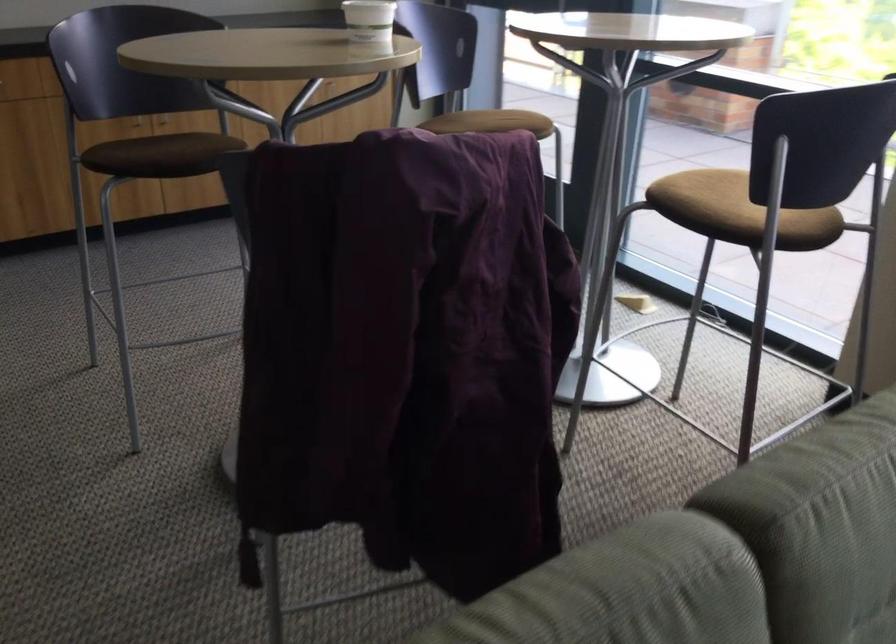
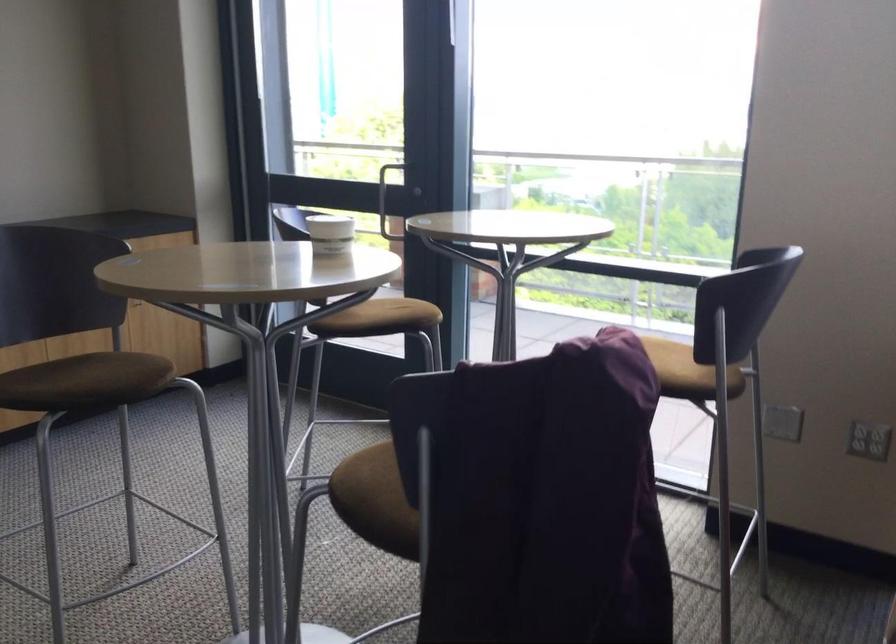
Find the pixel in the second image that matches [748,198] in the first image.

(669, 359)